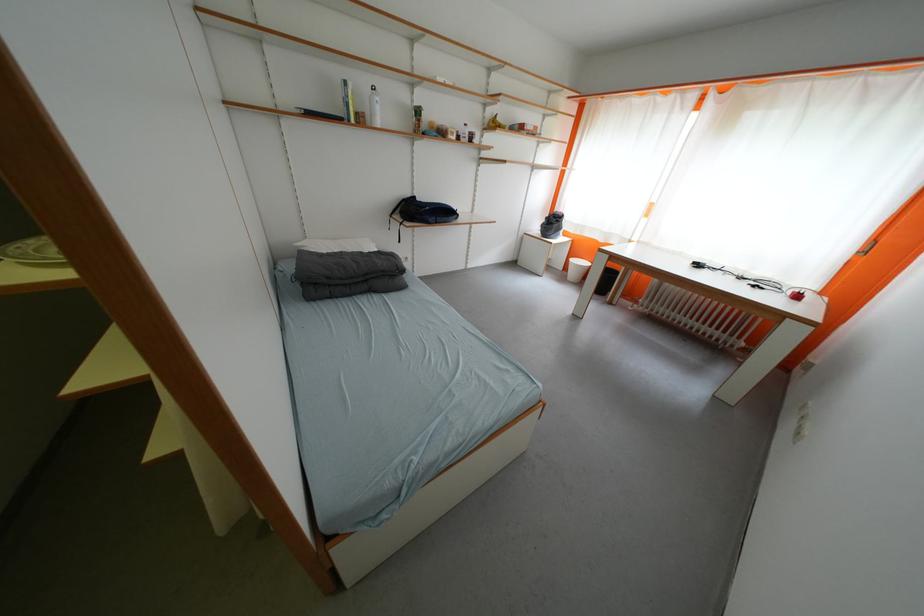
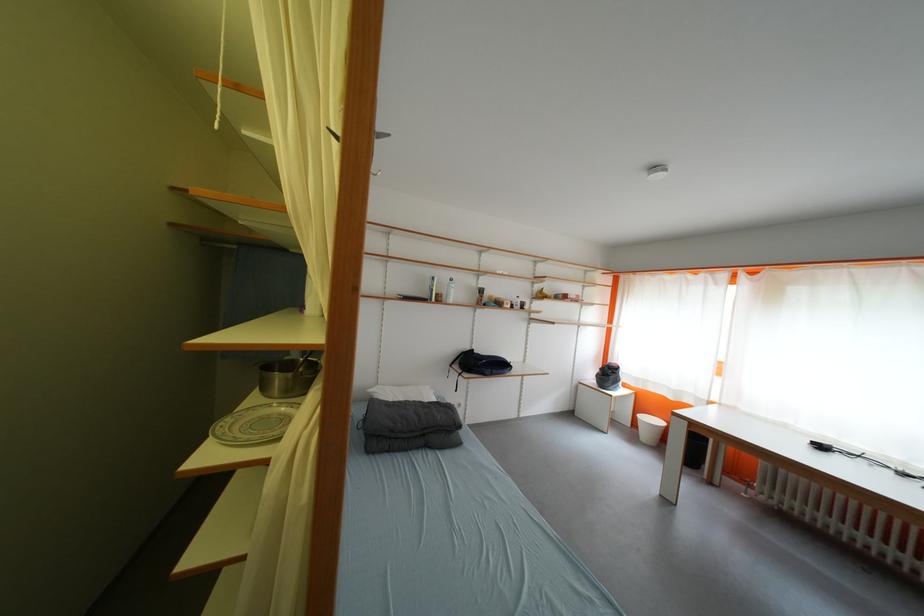
Where in the second image is the point corresponding to point 569,277 from the first image?

(639, 436)